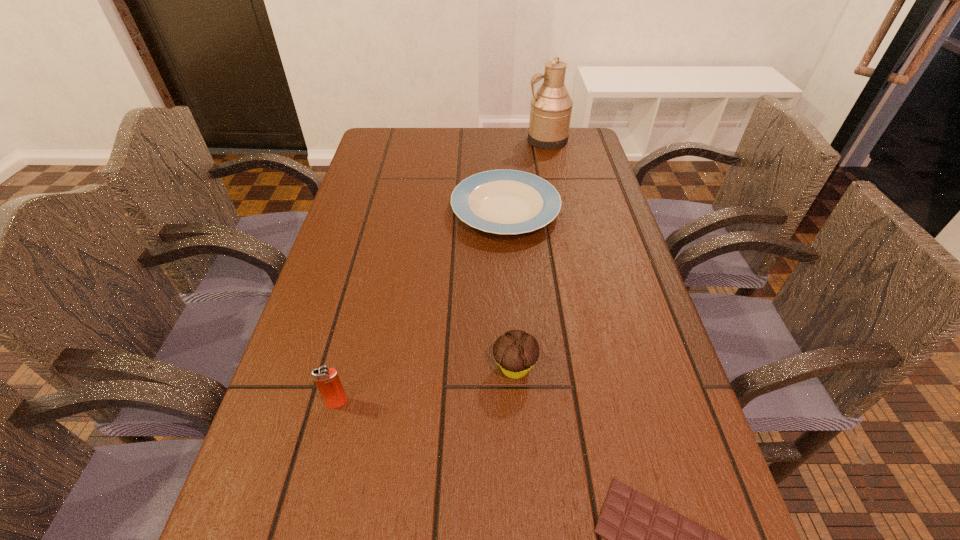
The image size is (960, 540). Find the location of `free space located 0.180m on the right of the third shortest object`. free space located 0.180m on the right of the third shortest object is located at coordinates (632, 368).

Where is `vacant region located on the front of the second farthest object`? This screenshot has width=960, height=540. vacant region located on the front of the second farthest object is located at coordinates (513, 323).

At what (x,y) coordinates should I click in order to perform the action: click on object positioned at the far edge. Please return your answer as a coordinate pair (x, y). Looking at the image, I should click on (550, 113).

Locate an element on the screen. This screenshot has height=540, width=960. object that is at the left edge is located at coordinates (327, 380).

At what (x,y) coordinates should I click in order to perform the action: click on pitcher that is at the right edge. Please return your answer as a coordinate pair (x, y). This screenshot has width=960, height=540. Looking at the image, I should click on (550, 113).

The height and width of the screenshot is (540, 960). Find the location of `plate present at the right edge`. plate present at the right edge is located at coordinates (497, 201).

Where is `object located in the far right corner section of the desktop`? Image resolution: width=960 pixels, height=540 pixels. object located in the far right corner section of the desktop is located at coordinates (550, 113).

Where is `vacant space at the far edge of the desktop`? The width and height of the screenshot is (960, 540). vacant space at the far edge of the desktop is located at coordinates (492, 151).

Where is `vacant space at the left edge of the desktop`? This screenshot has height=540, width=960. vacant space at the left edge of the desktop is located at coordinates (363, 258).

This screenshot has width=960, height=540. I want to click on free spot at the right edge of the desktop, so click(x=626, y=417).